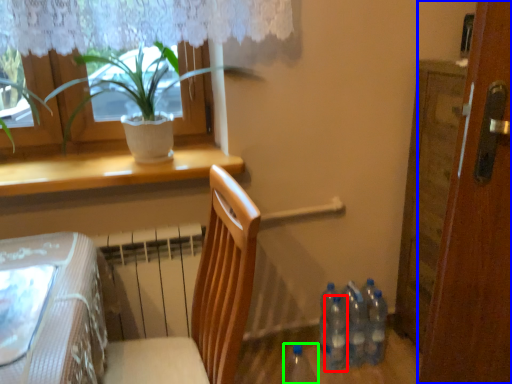
Question: Which object is the closest to the bottle (highlighted by a red box)? Choose among these: door (highlighted by a blue box) or bottle (highlighted by a green box).

Choices:
 (A) door
 (B) bottle

Answer: (B)